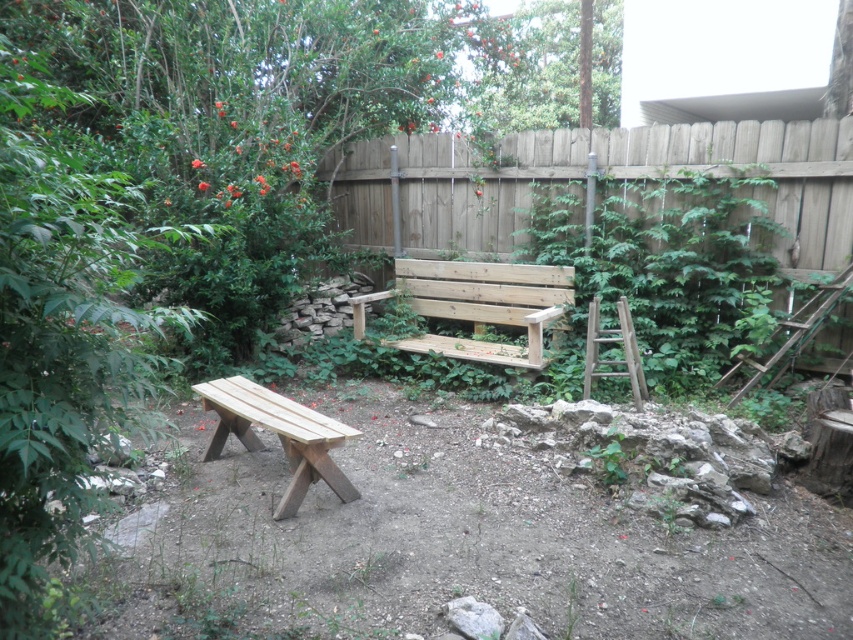
I want to click on wooden bench at center, so point(477,305).

Is the position of wooden bench at center more distant than that of natural wood bench at lower left?

Yes, it is behind natural wood bench at lower left.

Describe the element at coordinates (477, 305) in the screenshot. I see `wooden bench at center` at that location.

The image size is (853, 640). Identify the location of wooden bench at center. (477, 305).